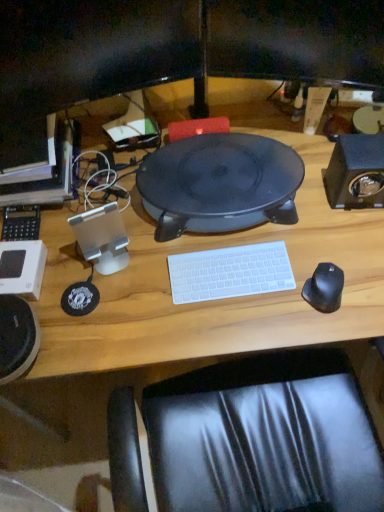
Question: Considering the relative sizes of black matte speaker at center and matte black monitor at left in the image provided, is black matte speaker at center smaller than matte black monitor at left?

Choices:
 (A) yes
 (B) no

Answer: (B)

Question: Could you tell me if black matte speaker at center is turned towards matte black monitor at left?

Choices:
 (A) yes
 (B) no

Answer: (B)

Question: From the image's perspective, is black matte speaker at center above matte black monitor at left?

Choices:
 (A) no
 (B) yes

Answer: (A)

Question: Is the position of black matte speaker at center more distant than that of matte black monitor at left?

Choices:
 (A) yes
 (B) no

Answer: (B)

Question: Is black matte speaker at center to the right of matte black monitor at left from the viewer's perspective?

Choices:
 (A) yes
 (B) no

Answer: (A)

Question: Is white plastic keyboard at center wider or thinner than black matte speaker at right?

Choices:
 (A) wide
 (B) thin

Answer: (B)

Question: Considering the positions of point (203, 263) and point (357, 164), is point (203, 263) closer or farther from the camera than point (357, 164)?

Choices:
 (A) closer
 (B) farther

Answer: (A)

Question: Considering their positions, is white plastic keyboard at center located in front of or behind black matte speaker at right?

Choices:
 (A) front
 (B) behind

Answer: (A)

Question: Looking at the image, does white plastic keyboard at center seem bigger or smaller compared to black matte speaker at right?

Choices:
 (A) big
 (B) small

Answer: (B)

Question: Is black matte speaker at right spatially inside white plastic keyboard at center, or outside of it?

Choices:
 (A) inside
 (B) outside

Answer: (B)

Question: In the image, is black matte speaker at right on the left side or the right side of white plastic keyboard at center?

Choices:
 (A) right
 (B) left

Answer: (A)

Question: Is black matte speaker at right in front of or behind white plastic keyboard at center in the image?

Choices:
 (A) behind
 (B) front

Answer: (A)

Question: From a real-world perspective, is black matte speaker at right physically located above or below white plastic keyboard at center?

Choices:
 (A) above
 (B) below

Answer: (A)

Question: Considering the positions of wooden desk at center and black matte mouse at right in the image, is wooden desk at center wider or thinner than black matte mouse at right?

Choices:
 (A) wide
 (B) thin

Answer: (A)

Question: Considering the positions of wooden desk at center and black matte mouse at right in the image, is wooden desk at center bigger or smaller than black matte mouse at right?

Choices:
 (A) big
 (B) small

Answer: (A)